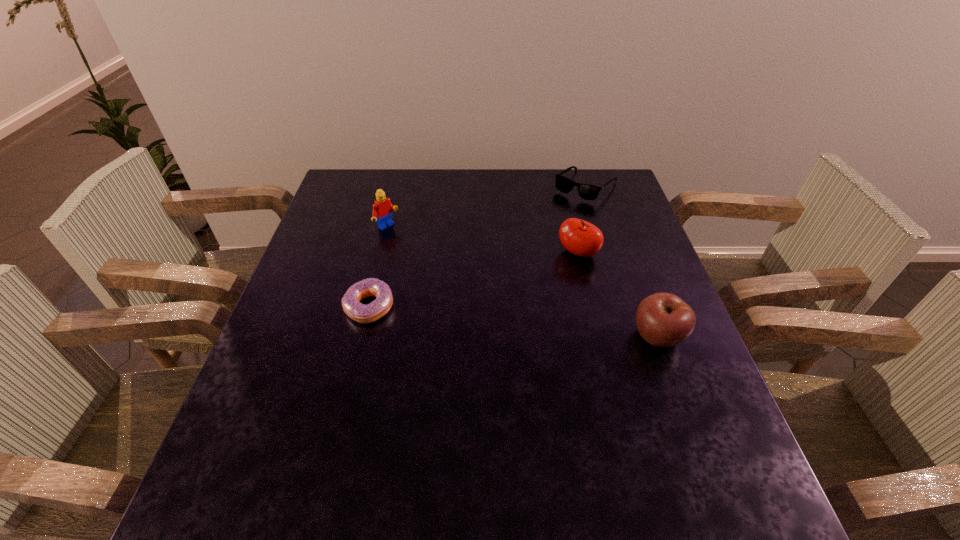
Locate which object is the fourth closest to the farthest object. Please provide its 2D coordinates. Your answer should be formatted as a tuple, i.e. [(x, y)], where the tuple contains the x and y coordinates of a point satisfying the conditions above.

[(359, 312)]

Locate an element on the screen. The image size is (960, 540). the third closest object to the Lego is located at coordinates (586, 191).

Identify the location of vacant area that satisfies the following two spatial constraints: 1. on the front side of the second farthest object; 2. on the left side of the farther apple. This screenshot has height=540, width=960. (381, 253).

The image size is (960, 540). I want to click on blank area in the image that satisfies the following two spatial constraints: 1. on the front side of the left apple; 2. on the right side of the Lego, so click(x=381, y=253).